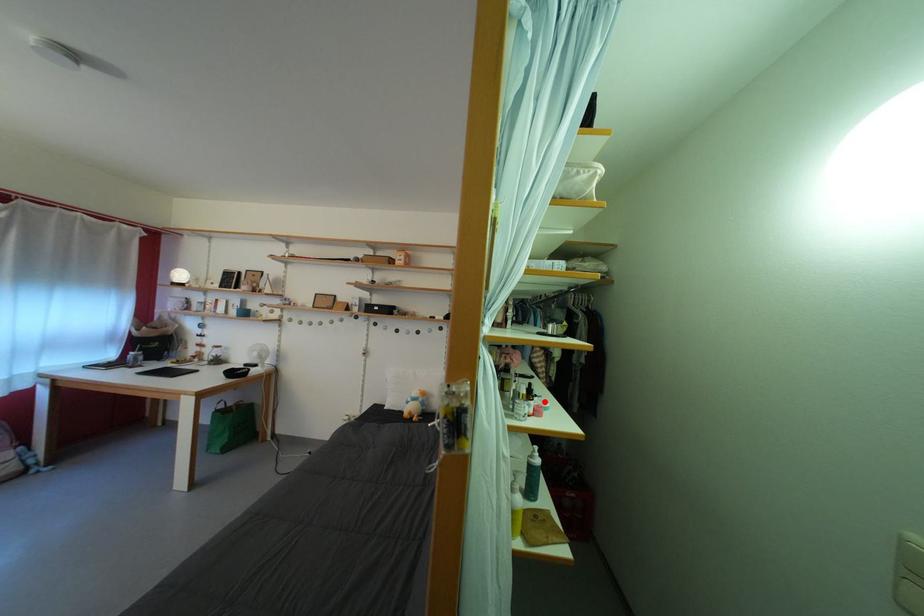
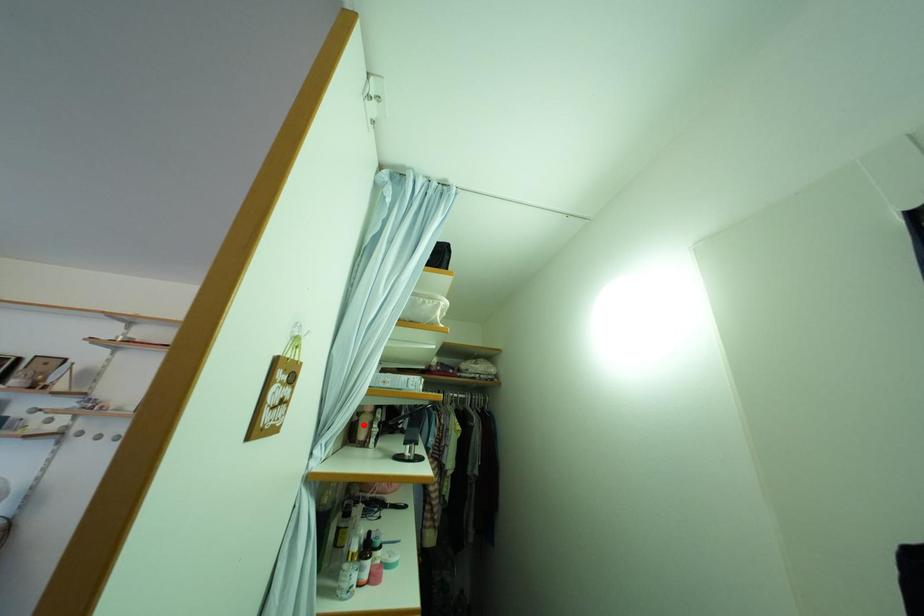
I am providing you with two images of the same scene from different viewpoints. A red point is marked on the first image and another point is marked on the second image. Is the red point in image1 aligned with the point shown in image2?

No